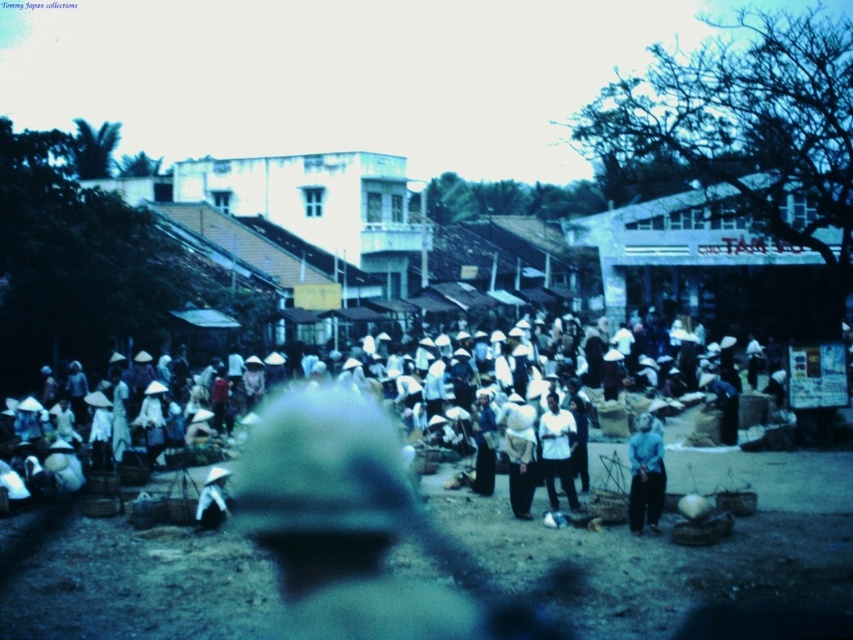
Between white fabric at center and white matte shirt at center, which one is positioned lower?

Positioned lower is white matte shirt at center.

Between point (509, 412) and point (570, 497), which one is positioned in front?

Point (570, 497)

Is point (502, 422) closer to viewer compared to point (555, 445)?

No, (502, 422) is further to viewer.

Find the location of `white fabric at center`. white fabric at center is located at coordinates (519, 452).

Is white woven hat at center positioned behind white matte shirt at center?

No, white woven hat at center is in front of white matte shirt at center.

Is white woven hat at center bigger than white matte shirt at center?

Yes, white woven hat at center is bigger than white matte shirt at center.

Image resolution: width=853 pixels, height=640 pixels. What are the coordinates of `white woven hat at center` in the screenshot? It's located at (708, 452).

Does white woven hat at center appear on the left side of blue fabric shirt at center?

Yes, white woven hat at center is to the left of blue fabric shirt at center.

Is white woven hat at center bigger than blue fabric shirt at center?

Yes.

Does point (759, 400) lie in front of point (635, 481)?

No, it is behind (635, 481).

At what (x,y) coordinates should I click in order to perform the action: click on white woven hat at center. Please return your answer as a coordinate pair (x, y). The image size is (853, 640). Looking at the image, I should click on (708, 452).